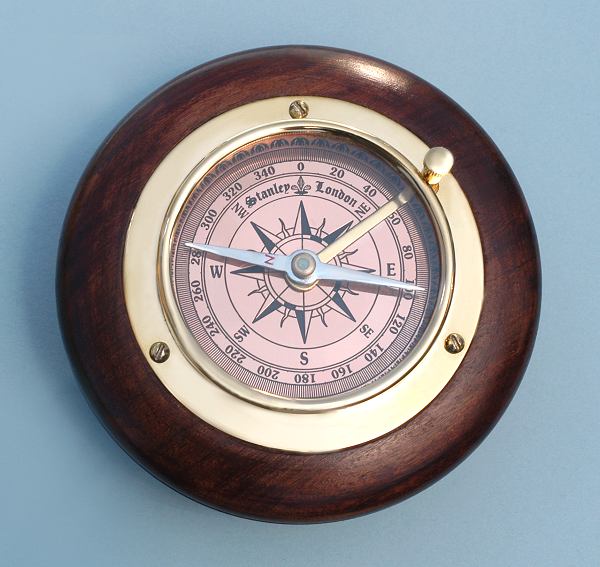
Image resolution: width=600 pixels, height=567 pixels. In order to click on brass arm in this screenshot , I will do `click(356, 234)`.